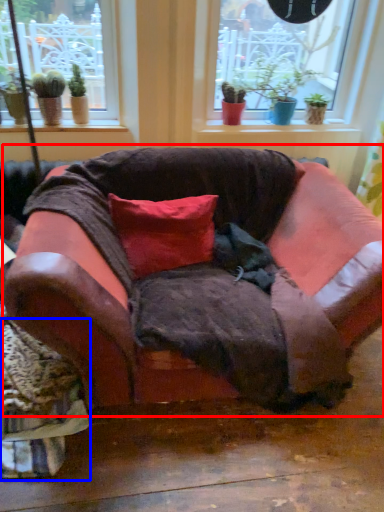
Question: Which point is further to the camera, studio couch (highlighted by a red box) or swivel chair (highlighted by a blue box)?

Choices:
 (A) studio couch
 (B) swivel chair

Answer: (B)